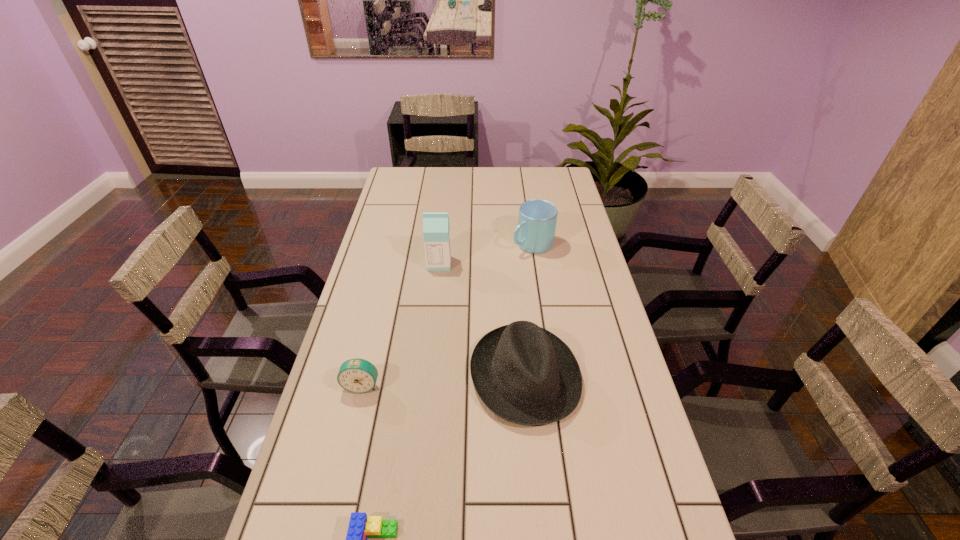
This screenshot has height=540, width=960. In order to click on milk carton in this screenshot , I will do `click(436, 227)`.

The image size is (960, 540). I want to click on mug, so click(x=535, y=233).

You are a GUI agent. You are given a task and a screenshot of the screen. Output one action in this format:
    pyautogui.click(x=<x>, y=<y>)
    Task: Click on the fedora
    The image size is (960, 540).
    Given the screenshot: What is the action you would take?
    pyautogui.click(x=526, y=375)

This screenshot has height=540, width=960. I want to click on alarm clock, so click(357, 375).

Locate an element on the screen. The height and width of the screenshot is (540, 960). the second shortest object is located at coordinates (357, 375).

Locate an element on the screen. vacant space situated 0.180m on the back of the milk carton is located at coordinates (444, 227).

I want to click on vacant space located on the back of the mug, so click(524, 191).

This screenshot has height=540, width=960. What are the coordinates of `free location located on the left of the fedora` in the screenshot? It's located at (437, 376).

The width and height of the screenshot is (960, 540). Find the location of `vacant space located on the front-facing side of the fourth tallest object`. vacant space located on the front-facing side of the fourth tallest object is located at coordinates (340, 476).

Find the location of `object located at the left edge`. object located at the left edge is located at coordinates (357, 375).